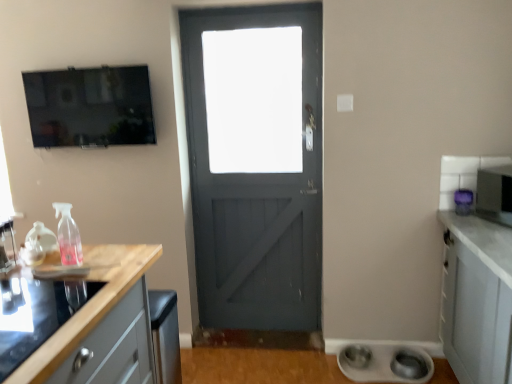
In order to click on free space in front of pink translucent spray bottle at left in this screenshot , I will do `click(41, 288)`.